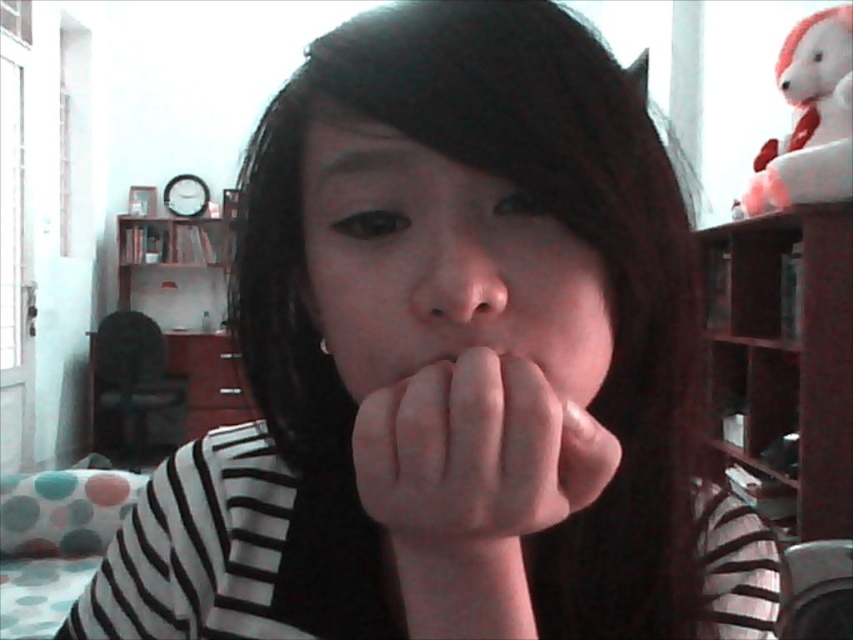
Question: Is wooden bookshelf at right to the right of pink flesh-colored hand at center from the viewer's perspective?

Choices:
 (A) no
 (B) yes

Answer: (B)

Question: Which of the following is the farthest from the observer?

Choices:
 (A) smooth skin nose at center
 (B) wooden bookshelf at left
 (C) wooden bookshelf at right
 (D) smooth skin face at center

Answer: (B)

Question: Where is smooth skin face at center located in relation to wooden bookshelf at left in the image?

Choices:
 (A) right
 (B) left

Answer: (A)

Question: Which point is closer to the camera?

Choices:
 (A) wooden bookshelf at right
 (B) pink flesh-colored hand at center
 (C) smooth skin face at center

Answer: (B)

Question: Is pink flesh-colored hand at center wider than wooden bookshelf at left?

Choices:
 (A) no
 (B) yes

Answer: (A)

Question: Considering the real-world distances, which object is closest to the smooth skin nose at center?

Choices:
 (A) pink matte lips at center
 (B) wooden bookshelf at left
 (C) white plush bear at upper right

Answer: (A)